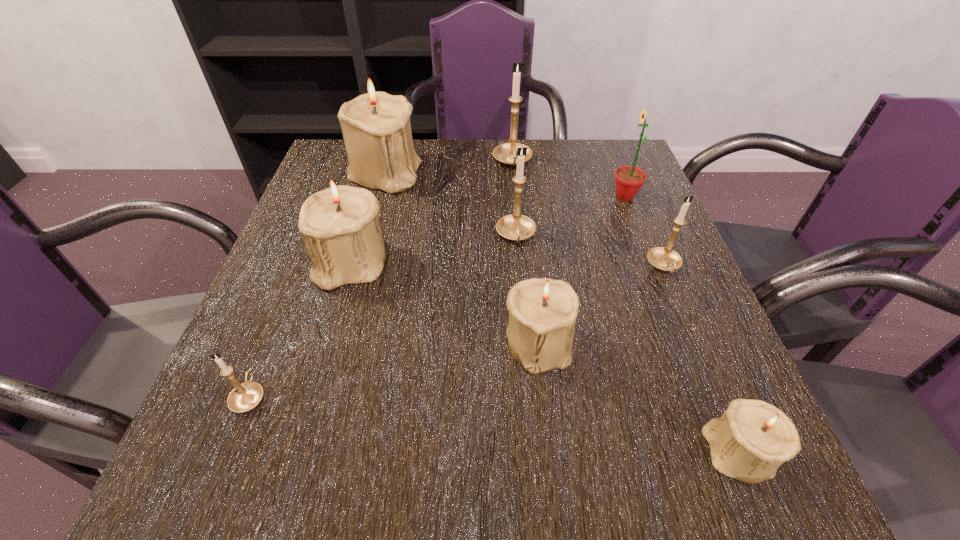
Image resolution: width=960 pixels, height=540 pixels. Identify the location of object that is at the near right corner. (752, 439).

Where is `free space at the far edge of the desktop`? free space at the far edge of the desktop is located at coordinates (468, 168).

In order to click on vacant area at the near edge of the desktop in this screenshot , I will do `click(540, 444)`.

At what (x,y) coordinates should I click in order to perform the action: click on vacant region at the left edge of the desktop. Please return your answer as a coordinate pair (x, y). Looking at the image, I should click on (287, 347).

In the image, there is a desktop. At what (x,y) coordinates should I click in order to perform the action: click on vacant space at the right edge. Please return your answer as a coordinate pair (x, y). The image size is (960, 540). Looking at the image, I should click on (670, 399).

In the image, there is a desktop. Identify the location of free region at the near right corner. This screenshot has height=540, width=960. (791, 497).

Identify the location of vacant space that's between the nearest gold candle holder and the second biggest gold candle holder. (383, 316).

Identify the location of vacant area that lies between the rightmost gold candle holder and the eighth farthest object. The image size is (960, 540). (457, 331).

Find the location of a particular element. Image resolution: width=960 pixels, height=540 pixels. vacant area that lies between the farthest beige candle_holder and the second biggest gold candle holder is located at coordinates (450, 205).

Locate an element on the screen. vacant space in between the smallest beige candle_holder and the seventh farthest object is located at coordinates (637, 397).